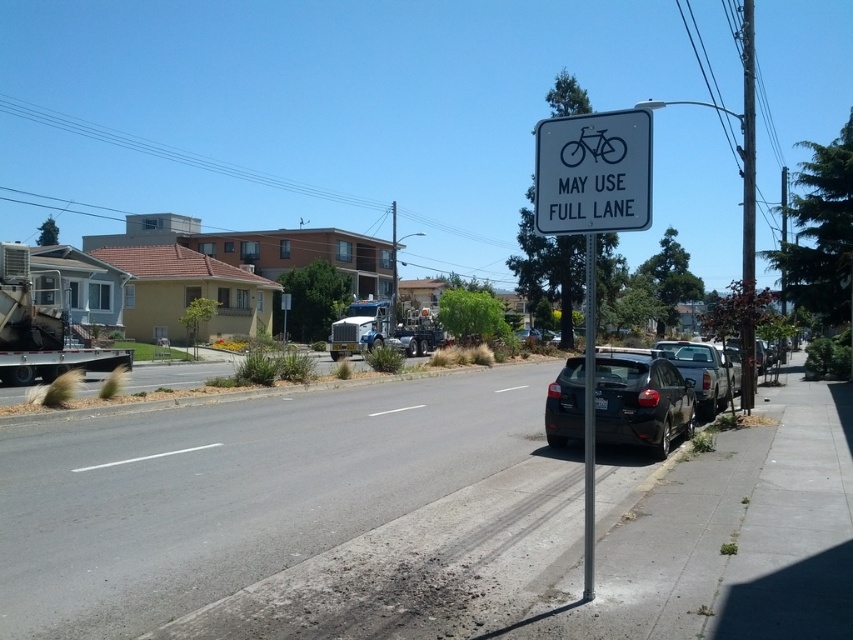
Question: Which point is farther to the camera?

Choices:
 (A) (570, 426)
 (B) (549, 163)
 (C) (747, 209)
 (D) (715, 364)

Answer: (D)

Question: Which point is farther to the camera?

Choices:
 (A) white plastic sign at upper center
 (B) silver metallic truck at right
 (C) metallic gray pole at right
 (D) black metal pole at center

Answer: (C)

Question: In this image, where is metallic gray pole at right located relative to black metal pole at center?

Choices:
 (A) below
 (B) above

Answer: (B)

Question: Among these objects, which one is nearest to the camera?

Choices:
 (A) metallic gray pole at right
 (B) white plastic sign at upper center

Answer: (B)

Question: Is shiny black sedan at center-right above metallic gray pole at right?

Choices:
 (A) no
 (B) yes

Answer: (A)

Question: Is metallic gray pole at right wider than silver metallic truck at right?

Choices:
 (A) yes
 (B) no

Answer: (A)